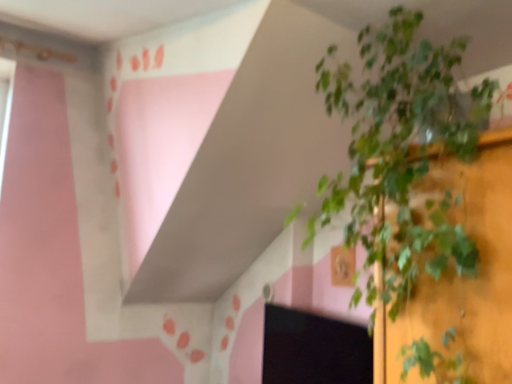
Question: Is green leafy plant at center oriented towards black matte computer screen at lower right?

Choices:
 (A) yes
 (B) no

Answer: (B)

Question: From the image's perspective, is green leafy plant at center located above black matte computer screen at lower right?

Choices:
 (A) no
 (B) yes

Answer: (B)

Question: Is the position of green leafy plant at center less distant than that of black matte computer screen at lower right?

Choices:
 (A) no
 (B) yes

Answer: (B)

Question: Is black matte computer screen at lower right at the back of green leafy plant at center?

Choices:
 (A) yes
 (B) no

Answer: (B)

Question: Is black matte computer screen at lower right inside green leafy plant at center?

Choices:
 (A) yes
 (B) no

Answer: (B)

Question: Considering the relative sizes of green leafy plant at center and black matte computer screen at lower right in the image provided, is green leafy plant at center bigger than black matte computer screen at lower right?

Choices:
 (A) no
 (B) yes

Answer: (B)

Question: Can you confirm if black matte computer screen at lower right is positioned to the left of green leafy plant at center?

Choices:
 (A) no
 (B) yes

Answer: (B)

Question: Is green leafy plant at center inside black matte computer screen at lower right?

Choices:
 (A) no
 (B) yes

Answer: (A)

Question: Is black matte computer screen at lower right oriented towards green leafy plant at center?

Choices:
 (A) no
 (B) yes

Answer: (A)

Question: Does black matte computer screen at lower right have a larger size compared to green leafy plant at center?

Choices:
 (A) yes
 (B) no

Answer: (B)

Question: Is black matte computer screen at lower right closer to camera compared to green leafy plant at center?

Choices:
 (A) yes
 (B) no

Answer: (B)

Question: Considering the relative positions of black matte computer screen at lower right and green leafy plant at center in the image provided, is black matte computer screen at lower right behind green leafy plant at center?

Choices:
 (A) yes
 (B) no

Answer: (A)

Question: From the image's perspective, is black matte computer screen at lower right above or below green leafy plant at center?

Choices:
 (A) above
 (B) below

Answer: (B)